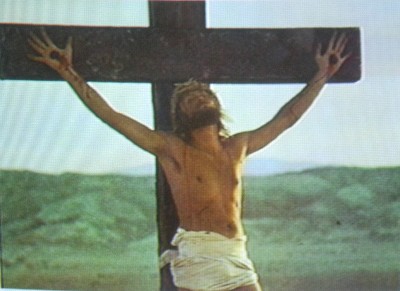
Identify the location of chest. tap(212, 171).